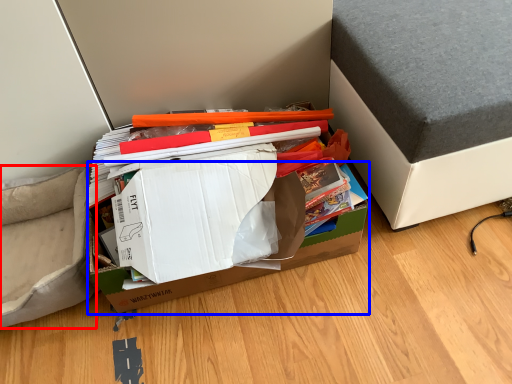
Question: Which point is further to the camera, armchair (highlighted by a red box) or cardboard box (highlighted by a blue box)?

Choices:
 (A) armchair
 (B) cardboard box

Answer: (A)